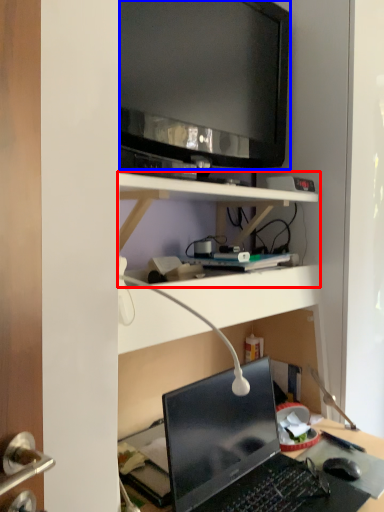
Question: Which point is further to the camera, shelf (highlighted by a red box) or television (highlighted by a blue box)?

Choices:
 (A) shelf
 (B) television

Answer: (B)